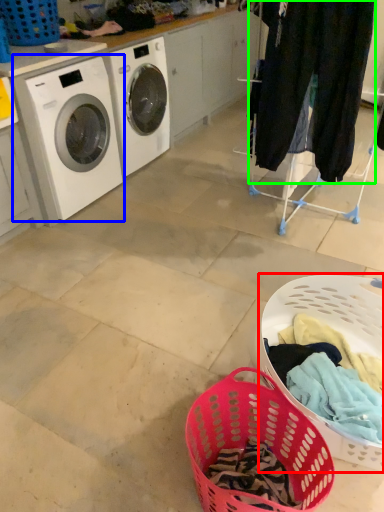
Question: Estimate the real-world distances between objects in this image. Which object is closer to basket (highlighted by a red box), washing machine (highlighted by a blue box) or clothing (highlighted by a green box)?

Choices:
 (A) washing machine
 (B) clothing

Answer: (B)